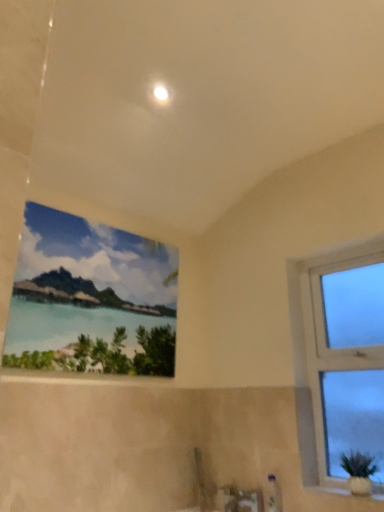
Question: Considering the positions of watercolor painting at upper center, the 1th window in the left-to-right sequence, and green matte plant at lower right in the image, is watercolor painting at upper center, the 1th window in the left-to-right sequence, wider or thinner than green matte plant at lower right?

Choices:
 (A) thin
 (B) wide

Answer: (A)

Question: Is watercolor painting at upper center, the 1th window in the left-to-right sequence, taller or shorter than green matte plant at lower right?

Choices:
 (A) short
 (B) tall

Answer: (B)

Question: Which is farther from the green matte plant at lower right?

Choices:
 (A) white glossy light at upper center
 (B) white glossy window sill at lower right
 (C) watercolor painting at upper center, the 1th window in the left-to-right sequence
 (D) white plastic window at right, placed as the 1th window when sorted from right to left

Answer: (A)

Question: Which of these objects is positioned farthest from the white glossy window sill at lower right?

Choices:
 (A) green matte plant at lower right
 (B) white plastic window at right, placed as the 1th window when sorted from right to left
 (C) watercolor painting at upper center, the second window viewed from the right
 (D) white glossy light at upper center

Answer: (D)